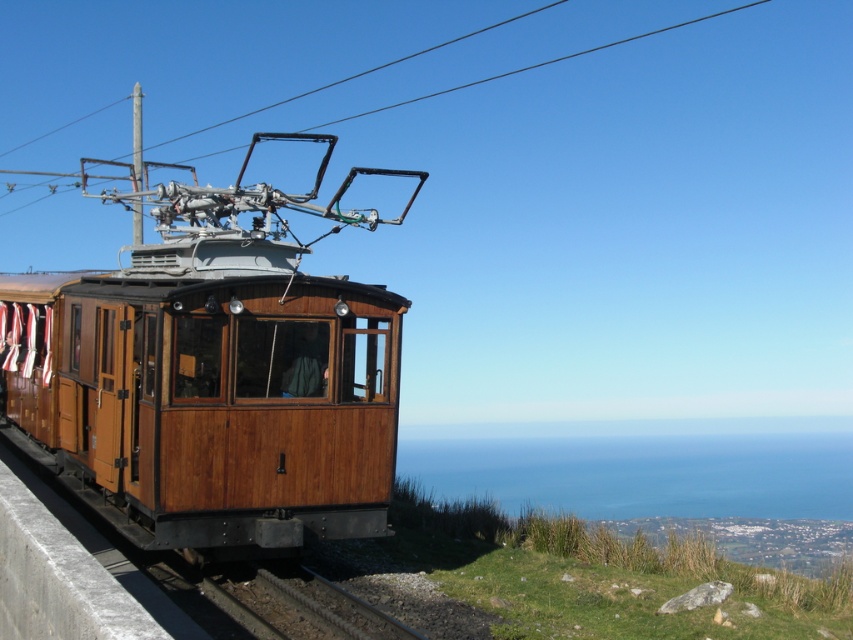
Question: Based on their relative distances, which object is nearer to the dark brown metal train track at lower center?

Choices:
 (A) wooden train car at center
 (B) metallic wire at upper center

Answer: (A)

Question: Estimate the real-world distances between objects in this image. Which object is closer to the wooden train car at center?

Choices:
 (A) metallic wire at upper center
 (B) dark brown metal train track at lower center

Answer: (B)

Question: Is wooden train car at center positioned in front of dark brown metal train track at lower center?

Choices:
 (A) no
 (B) yes

Answer: (A)

Question: Which of these objects is positioned farthest from the wooden train car at center?

Choices:
 (A) metallic wire at upper center
 (B) dark brown metal train track at lower center

Answer: (A)

Question: Can you confirm if dark brown metal train track at lower center is positioned above metallic wire at upper center?

Choices:
 (A) yes
 (B) no

Answer: (B)

Question: Is wooden train car at center below dark brown metal train track at lower center?

Choices:
 (A) no
 (B) yes

Answer: (A)